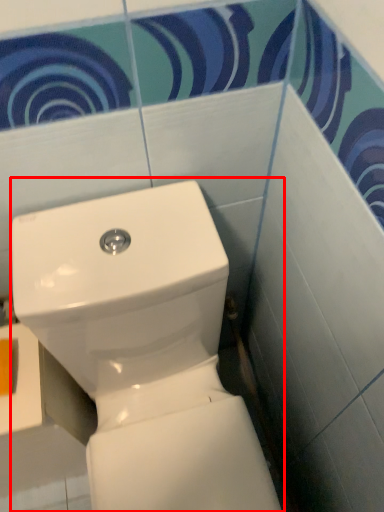
Question: Considering the relative positions of toilet (annotated by the red box) and toilet paper in the image provided, where is toilet (annotated by the red box) located with respect to the staircase?

Choices:
 (A) right
 (B) left

Answer: (A)